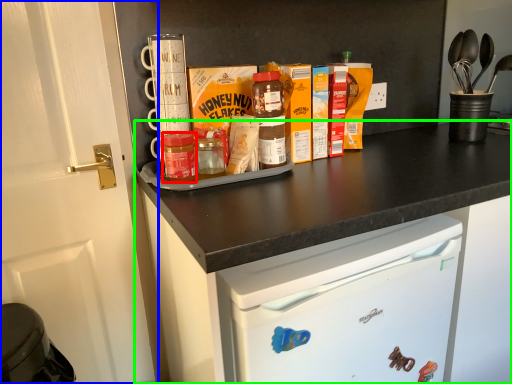
Question: Considering the real-world distances, which object is farthest from bottle (highlighted by a red box)? door (highlighted by a blue box) or cabinetry (highlighted by a green box)?

Choices:
 (A) door
 (B) cabinetry

Answer: (B)